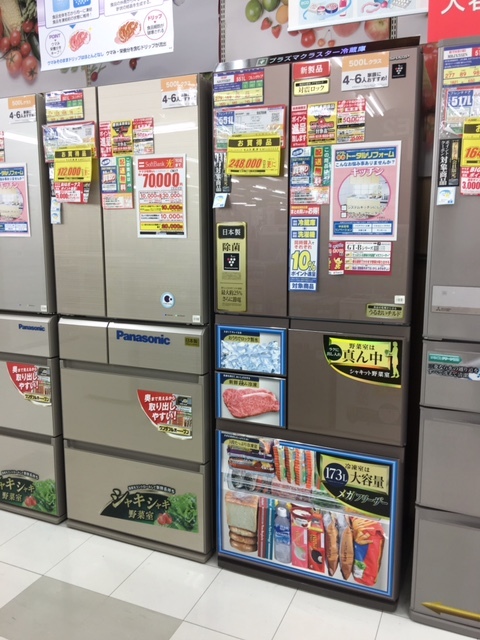
Locate an element on the screen. Image resolution: width=480 pixels, height=640 pixels. freezer is located at coordinates (252, 192), (75, 230), (464, 234).